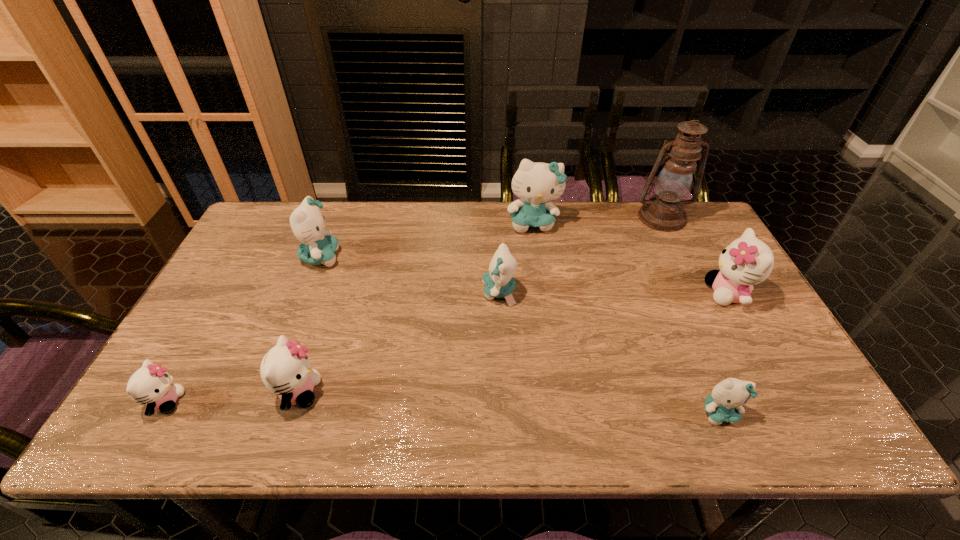
Image resolution: width=960 pixels, height=540 pixels. I want to click on free space at the far edge of the desktop, so click(x=330, y=218).

What are the coordinates of `vacant space at the near edge` in the screenshot? It's located at (299, 418).

Locate an element on the screen. free space at the left edge of the desktop is located at coordinates (173, 374).

You are a GUI agent. You are given a task and a screenshot of the screen. Output one action in this format:
    pyautogui.click(x=<x>, y=<y>)
    Task: Click on the vacant region at the right edge
    Image resolution: width=960 pixels, height=540 pixels.
    Given the screenshot: What is the action you would take?
    pyautogui.click(x=726, y=316)

You are a GUI agent. You are given a task and a screenshot of the screen. Output one action in this format:
    pyautogui.click(x=<x>, y=<y>)
    Task: Click on the vacant space at the near left corner
    Image resolution: width=960 pixels, height=540 pixels.
    Given the screenshot: What is the action you would take?
    pyautogui.click(x=199, y=440)

Where is `vacant region at the far right corner of the desktop`? vacant region at the far right corner of the desktop is located at coordinates (685, 245).

The width and height of the screenshot is (960, 540). In order to click on free space that is in between the third farthest blue kitten and the leftmost kitten in this screenshot , I will do `click(332, 347)`.

The height and width of the screenshot is (540, 960). Find the location of `unoccupied area between the rightmost kitten and the oil lamp`. unoccupied area between the rightmost kitten and the oil lamp is located at coordinates (695, 255).

Where is `free space that is in between the second farthest blue kitten and the rightmost blue kitten`? The width and height of the screenshot is (960, 540). free space that is in between the second farthest blue kitten and the rightmost blue kitten is located at coordinates (519, 335).

Locate an element on the screen. free area in between the seventh shortest object and the second kitten from right to left is located at coordinates (626, 318).